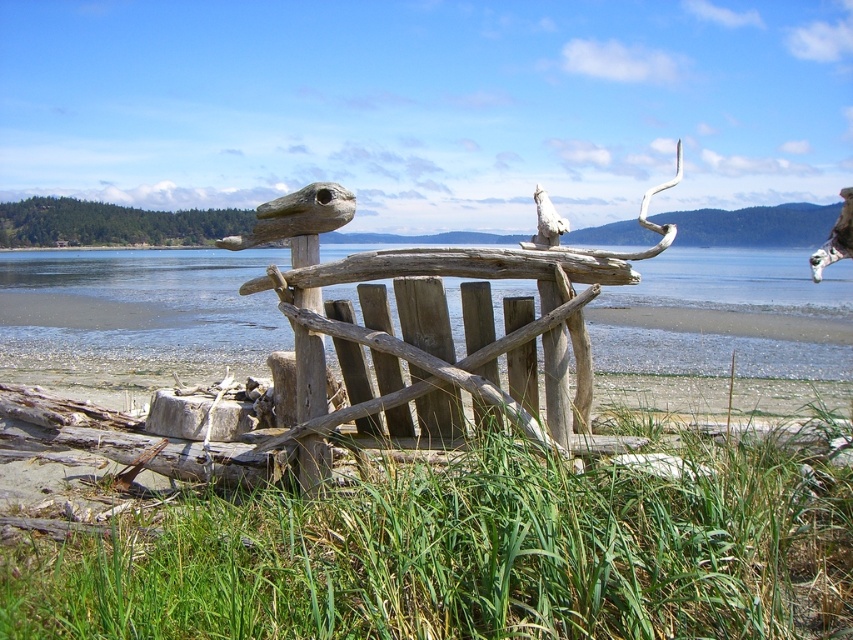
Is point (498, 516) farther from camera compared to point (554, 337)?

No, (498, 516) is closer to viewer.

The width and height of the screenshot is (853, 640). I want to click on green grass at lower center, so click(x=474, y=556).

Which is more to the right, brown wooden water at center or driftwood bench at center?

From the viewer's perspective, brown wooden water at center appears more on the right side.

Is point (202, 353) farther from viewer compared to point (399, 417)?

That is True.

You are a GUI agent. You are given a task and a screenshot of the screen. Output one action in this format:
    pyautogui.click(x=<x>, y=<y>)
    Task: Click on the brown wooden water at center
    The width and height of the screenshot is (853, 640).
    Given the screenshot: What is the action you would take?
    pyautogui.click(x=137, y=310)

Looking at this image, measure the distance from green grass at lower center to brown wooden water at center.

The distance of green grass at lower center from brown wooden water at center is 6.58 meters.

Is point (386, 556) positioned before point (496, 282)?

Yes, point (386, 556) is closer to viewer.

Is point (457, 476) positioned behind point (107, 253)?

No.

Locate an element on the screen. The width and height of the screenshot is (853, 640). green grass at lower center is located at coordinates (474, 556).